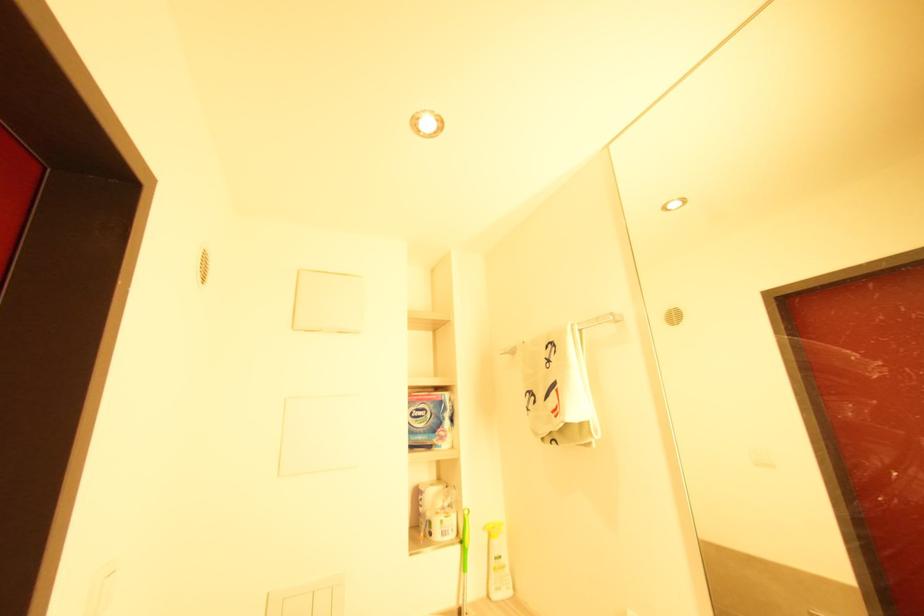
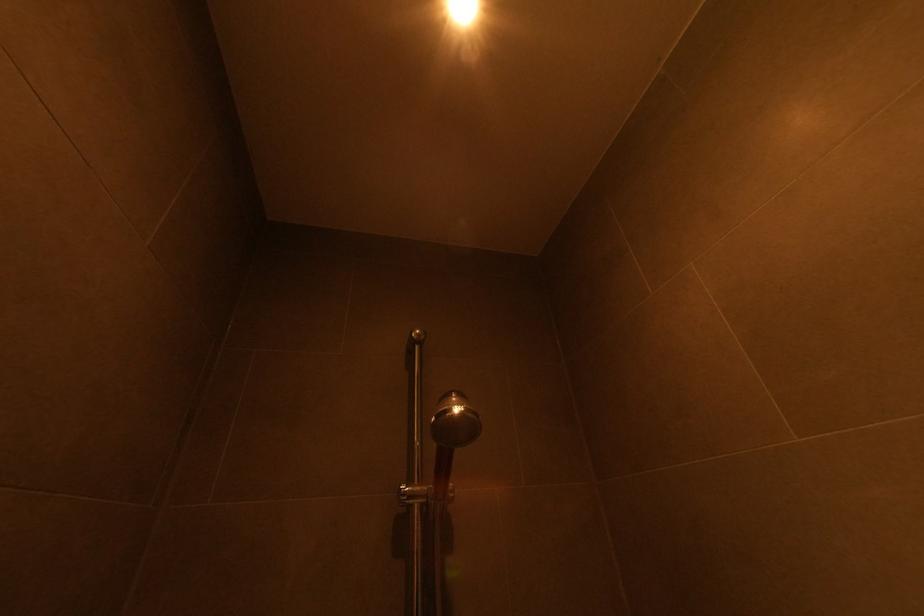
First-person continuous shooting, in which direction is the camera rotating?

The camera's rotation is toward right-up.